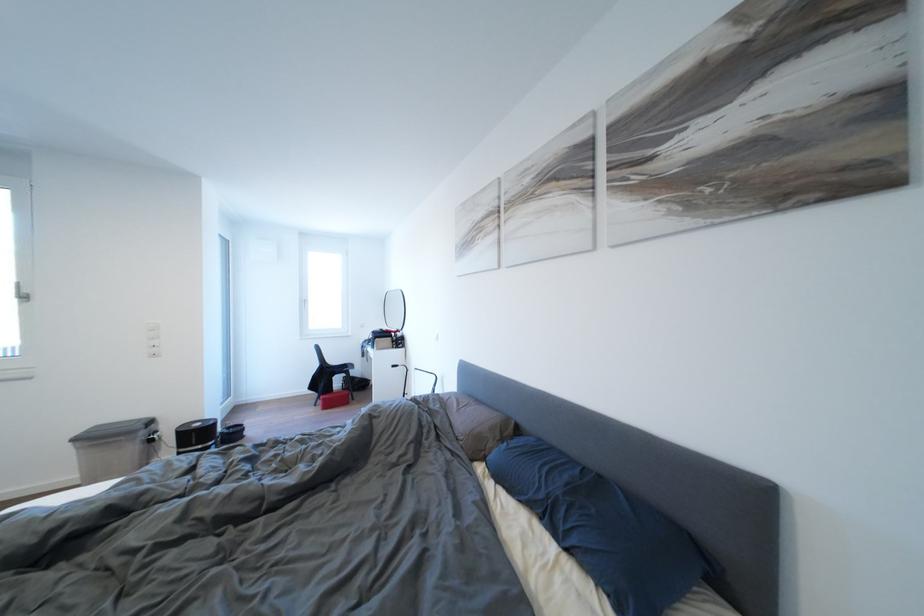
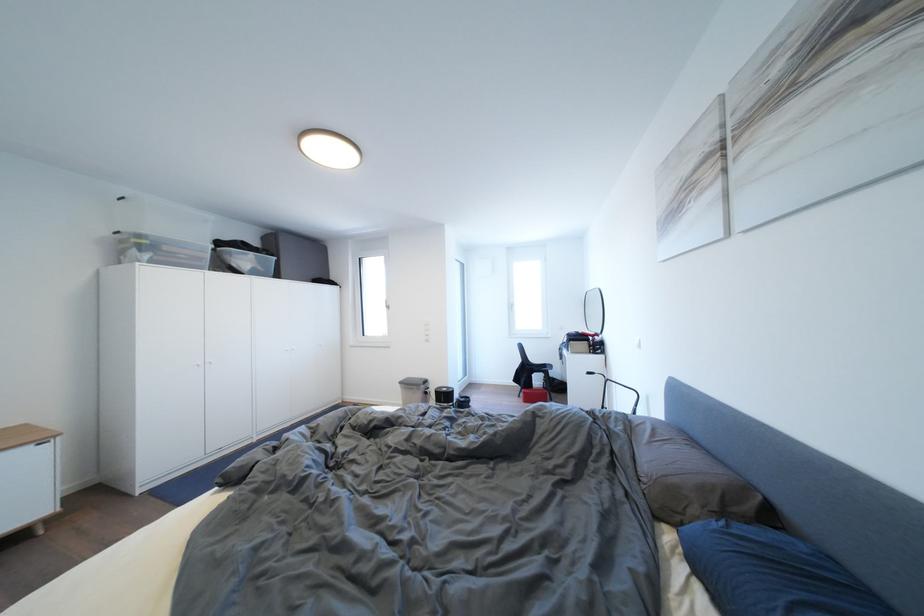
Find the pixel in the second image that matches point 332,405 in the first image.

(532, 398)